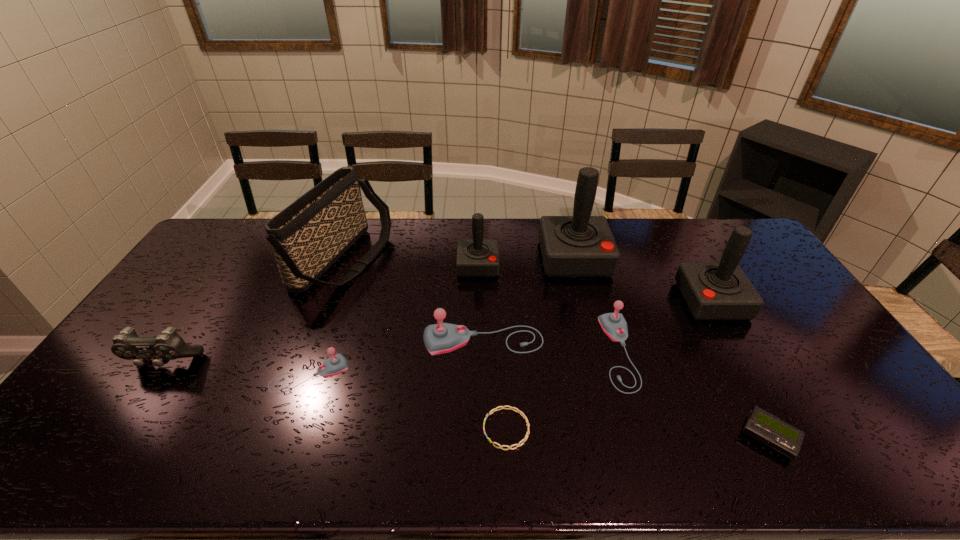
Locate which object is the eighth closest to the beeper. Please provide its 2D coordinates. Your answer should be formatted as a tuple, i.e. [(x, y)], where the tuple contains the x and y coordinates of a point satisfying the conditions above.

[(307, 237)]

You are a GUI agent. You are given a task and a screenshot of the screen. Output one action in this format:
    pyautogui.click(x=<x>, y=<y>)
    Task: Click on the fifth closest joystick to the rightmost joystick
    This screenshot has width=960, height=540.
    Given the screenshot: What is the action you would take?
    pyautogui.click(x=336, y=364)

Find the location of a particular element. joystick that is the second closest one to the fourth tallest object is located at coordinates (439, 338).

You are a GUI agent. You are given a task and a screenshot of the screen. Output one action in this format:
    pyautogui.click(x=<x>, y=<y>)
    Task: Click on the red joystick identified as the third closest to the second biggest gray joystick
    This screenshot has width=960, height=540.
    Given the screenshot: What is the action you would take?
    pyautogui.click(x=477, y=257)

Where is `red joystick that stands as the closest to the fourth shortest object`? red joystick that stands as the closest to the fourth shortest object is located at coordinates (581, 245).

Choose which gray joystick is the second nearest neighbor to the beeper. Please provide its 2D coordinates. Your answer should be formatted as a tuple, i.e. [(x, y)], where the tuple contains the x and y coordinates of a point satisfying the conditions above.

[(439, 338)]

Locate which gray joystick is the third closest to the ninth tallest object. Please provide its 2D coordinates. Your answer should be formatted as a tuple, i.e. [(x, y)], where the tuple contains the x and y coordinates of a point satisfying the conditions above.

[(336, 364)]

Where is `vacant space that satisfies the following two spatial constraints: 1. on the base of the rightmost red joystick; 2. on the front side of the third shortest joystick`? vacant space that satisfies the following two spatial constraints: 1. on the base of the rightmost red joystick; 2. on the front side of the third shortest joystick is located at coordinates pyautogui.click(x=734, y=341).

I want to click on vacant space that satisfies the following two spatial constraints: 1. on the base of the second biggest red joystick; 2. on the front side of the shortest joystick, so click(754, 375).

Locate an element on the screen. The width and height of the screenshot is (960, 540). vacant region that satisfies the following two spatial constraints: 1. on the back side of the biggest gray joystick; 2. on the left side of the smallest gray joystick is located at coordinates (322, 341).